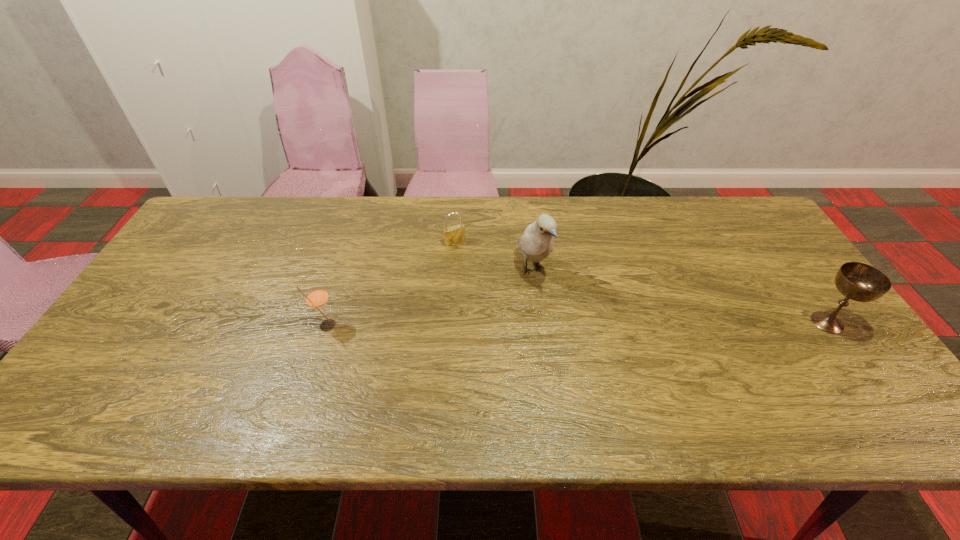
The width and height of the screenshot is (960, 540). What are the coordinates of `vacant space at the near left corner of the desktop` in the screenshot? It's located at (95, 368).

At what (x,y) coordinates should I click in order to perform the action: click on vacant space at the far right corner of the desktop. Please return your answer as a coordinate pair (x, y). Looking at the image, I should click on (723, 208).

In the image, there is a desktop. Where is `vacant space at the near right corner`? This screenshot has height=540, width=960. vacant space at the near right corner is located at coordinates [x=882, y=384].

You are a GUI agent. You are given a task and a screenshot of the screen. Output one action in this format:
    pyautogui.click(x=<x>, y=<y>)
    Task: Click on the vacant area between the second farthest object and the leftmost object
    This screenshot has width=960, height=540.
    Given the screenshot: What is the action you would take?
    pyautogui.click(x=430, y=298)

The image size is (960, 540). I want to click on empty location between the straw and the rightmost object, so click(577, 324).

This screenshot has width=960, height=540. I want to click on vacant space in between the leftmost object and the rightmost object, so click(x=577, y=324).

This screenshot has height=540, width=960. What are the coordinates of `vacant region between the second object from left to right and the rightmost object` in the screenshot? It's located at (641, 282).

At what (x,y) coordinates should I click in order to perform the action: click on free area in between the leftmost object and the second farthest object. Please return your answer as a coordinate pair (x, y). Image resolution: width=960 pixels, height=540 pixels. Looking at the image, I should click on (430, 298).

Locate an element on the screen. The width and height of the screenshot is (960, 540). vacant space that's between the chalice and the leftmost object is located at coordinates (577, 324).

The image size is (960, 540). Find the location of `empty space that is in between the chalice and the leftmost object`. empty space that is in between the chalice and the leftmost object is located at coordinates (577, 324).